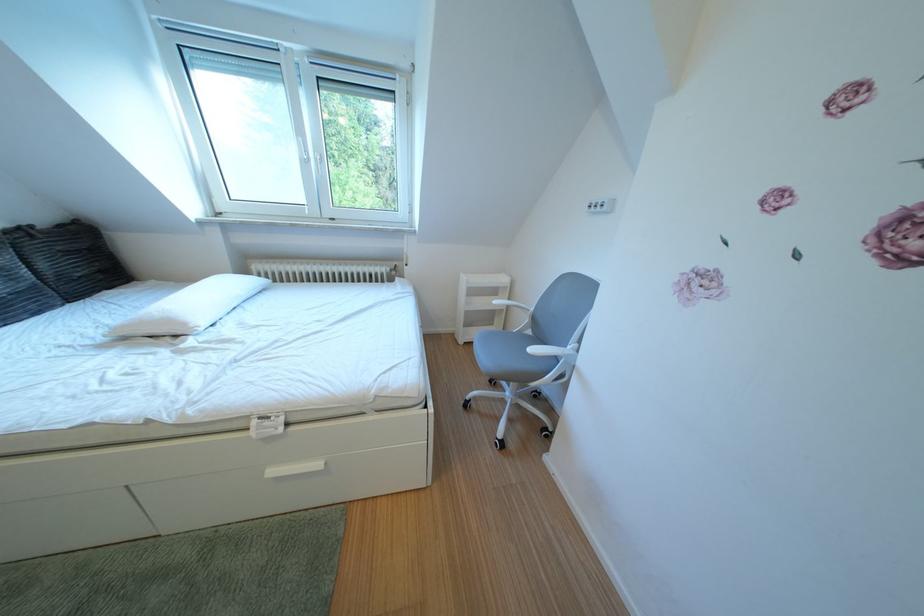
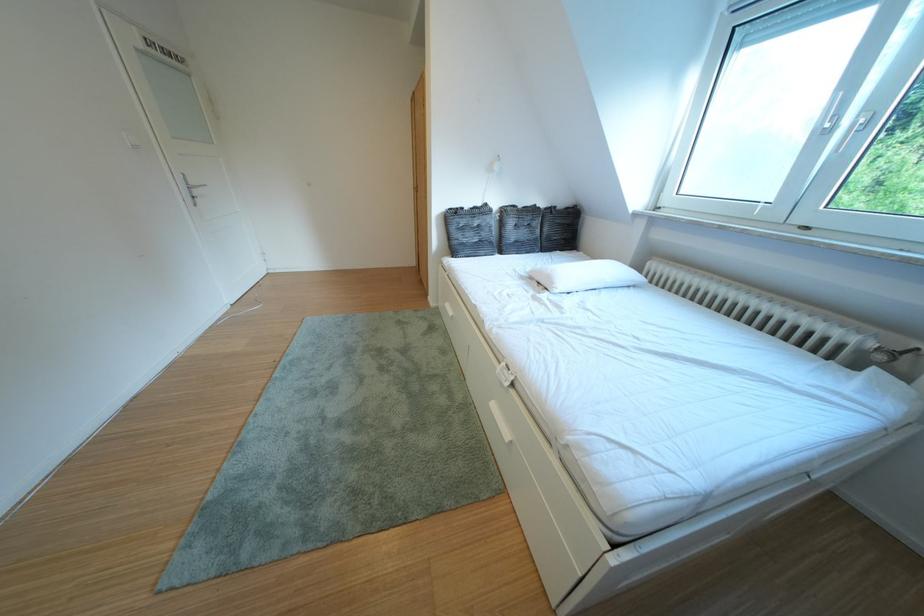
Locate, in the second image, the point that corresponds to the point at 199,330 in the first image.

(565, 288)